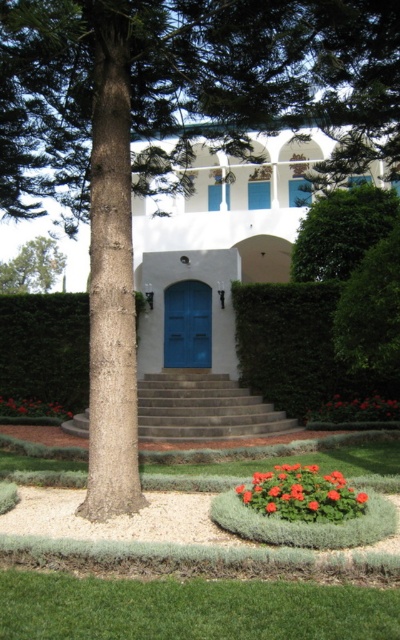
You are a gardener planning to plant new flowers in the garden. You notice the green leafy hedge at center and the bright red petals at lower center. Which object is located above the other?

The green leafy hedge at center is positioned over bright red petals at lower center.

You are standing at point A in the garden. You need to walk to the building entrance, which is located at point B. The coordinates for point A are given as point A is at point (299, 348). The path to the building is blocked by a green leafy hedge at center. Can you go around the hedge to reach the building entrance?

The green leafy hedge at center is located at point (299, 348), so you can go around it to reach the building entrance.

You are standing in the garden and want to take a photo of the two points marked in the image. Which point, point (x=329, y=422) or point (x=10, y=404), will appear larger in your camera view?

Point (x=329, y=422) will appear larger in the camera view because it is closer to the camera than point (x=10, y=404).